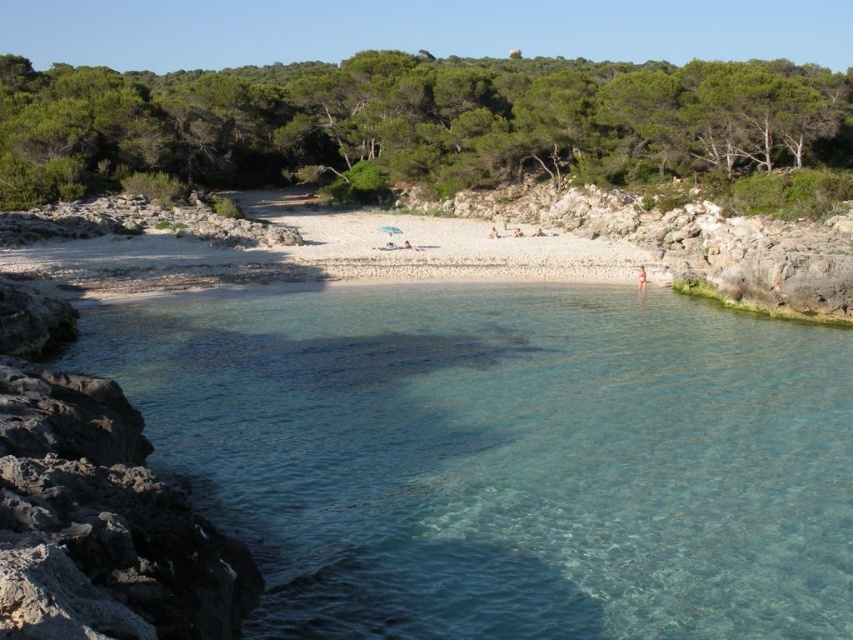
You are a marine biologist studying underwater visibility. You have a device that can measure visibility at specific coordinates. If you use it at point (503, 458), what would you expect to find?

The point (503, 458) marks clear glass water at center, so you would find clear visibility there.

You are a beachgoer who wants to place a large inflatable float on the white gravel beach at center. However, you notice the clear glass water at center nearby. Which object is to the left of the other? Knowing this will help you decide where to place the float so it doesn

The clear glass water at center is positioned on the right side of white gravel beach at center. Therefore, the white gravel beach at center is to the left of the clear glass water at center. To place the float safely away from the water, you should position it on the left side of the clear glass water at center, which corresponds to the white gravel beach at center.